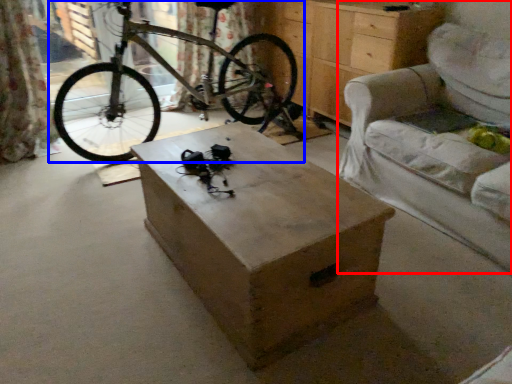
Question: Among these objects, which one is nearest to the camera, armchair (highlighted by a red box) or bicycle (highlighted by a blue box)?

Choices:
 (A) armchair
 (B) bicycle

Answer: (A)